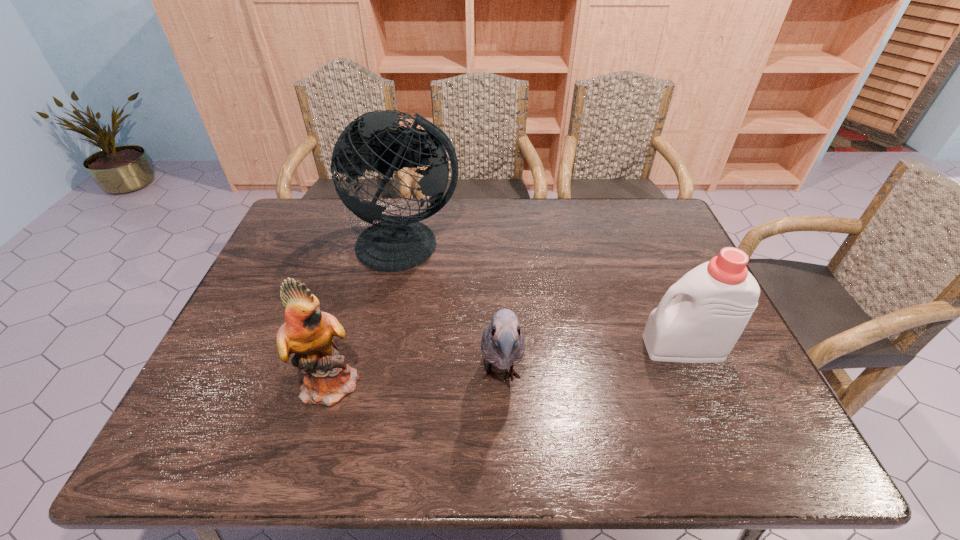
Identify the location of the tallest object. (396, 243).

What are the coordinates of `the farthest object` in the screenshot? It's located at (396, 243).

Image resolution: width=960 pixels, height=540 pixels. I want to click on the left parrot, so point(327,378).

You are a GUI agent. You are given a task and a screenshot of the screen. Output one action in this format:
    pyautogui.click(x=<x>, y=<y>)
    Task: Click on the second tallest object
    The width and height of the screenshot is (960, 540).
    Given the screenshot: What is the action you would take?
    pyautogui.click(x=327, y=378)

Where is `detergent`? This screenshot has width=960, height=540. detergent is located at coordinates (715, 300).

Locate an element on the screen. The width and height of the screenshot is (960, 540). the third object from left to right is located at coordinates (502, 344).

Where is `the shorter parrot`? This screenshot has width=960, height=540. the shorter parrot is located at coordinates (502, 344).

You are a GUI agent. You are given a task and a screenshot of the screen. Output one action in this format:
    pyautogui.click(x=<x>, y=<y>)
    Task: Click on the vacant space located on the front-facing side of the globe
    Image resolution: width=960 pixels, height=540 pixels.
    Given the screenshot: What is the action you would take?
    pyautogui.click(x=385, y=358)

Where is `free location located on the front-facing side of the left parrot`? free location located on the front-facing side of the left parrot is located at coordinates (444, 382).

Where is `vacant space located on the handle side of the rightmost object`? vacant space located on the handle side of the rightmost object is located at coordinates (494, 347).